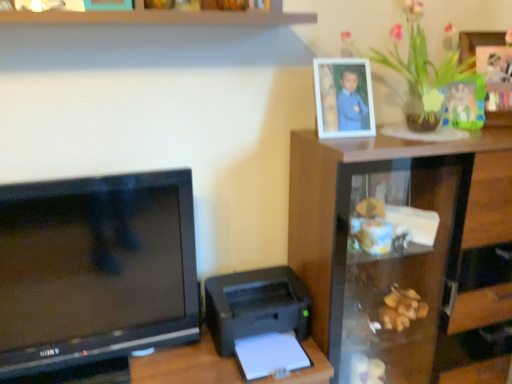
Question: Is black plastic printer at lower right to the left or to the right of transparent glass cabinet at upper right in the image?

Choices:
 (A) right
 (B) left

Answer: (B)

Question: Is black plastic printer at lower right taller or shorter than transparent glass cabinet at upper right?

Choices:
 (A) short
 (B) tall

Answer: (A)

Question: Which is farther from the black glossy television at left?

Choices:
 (A) black plastic printer at lower right
 (B) transparent glass cabinet at upper right
 (C) white plastic picture frame at upper right
 (D) green leafy plant at upper right

Answer: (D)

Question: Considering the real-world distances, which object is closest to the black plastic printer at lower right?

Choices:
 (A) white plastic picture frame at upper right
 (B) black glossy television at left
 (C) green leafy plant at upper right
 (D) transparent glass cabinet at upper right

Answer: (B)